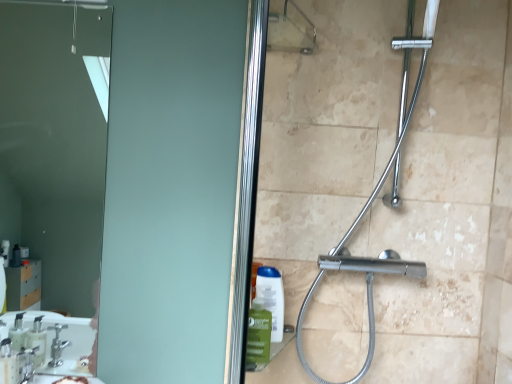
Question: Is matte glass mirror at upper left positioned beyond the bounds of chrome metallic shower at center?

Choices:
 (A) yes
 (B) no

Answer: (A)

Question: From the image's perspective, is matte glass mirror at upper left located above chrome metallic shower at center?

Choices:
 (A) yes
 (B) no

Answer: (A)

Question: Considering the relative positions of matte glass mirror at upper left and chrome metallic shower at center in the image provided, is matte glass mirror at upper left to the left of chrome metallic shower at center from the viewer's perspective?

Choices:
 (A) yes
 (B) no

Answer: (A)

Question: Is matte glass mirror at upper left smaller than chrome metallic shower at center?

Choices:
 (A) no
 (B) yes

Answer: (B)

Question: Is matte glass mirror at upper left positioned far away from chrome metallic shower at center?

Choices:
 (A) no
 (B) yes

Answer: (B)

Question: Is chrome metallic shower at center at the back of matte glass mirror at upper left?

Choices:
 (A) yes
 (B) no

Answer: (B)

Question: From a real-world perspective, does translucent plastic soap dispenser at lower left sit lower than matte glass mirror at upper left?

Choices:
 (A) yes
 (B) no

Answer: (A)

Question: Can matte glass mirror at upper left be found inside translucent plastic soap dispenser at lower left?

Choices:
 (A) no
 (B) yes

Answer: (A)

Question: From the image's perspective, is translucent plastic soap dispenser at lower left located beneath matte glass mirror at upper left?

Choices:
 (A) no
 (B) yes

Answer: (B)

Question: Is translucent plastic soap dispenser at lower left oriented towards matte glass mirror at upper left?

Choices:
 (A) yes
 (B) no

Answer: (B)

Question: From the image's perspective, is translucent plastic soap dispenser at lower left on top of matte glass mirror at upper left?

Choices:
 (A) no
 (B) yes

Answer: (A)

Question: Is translucent plastic soap dispenser at lower left beside matte glass mirror at upper left?

Choices:
 (A) no
 (B) yes

Answer: (A)

Question: Is translucent plastic soap dispenser at lower left completely or partially outside of chrome metallic shower at center?

Choices:
 (A) no
 (B) yes

Answer: (B)